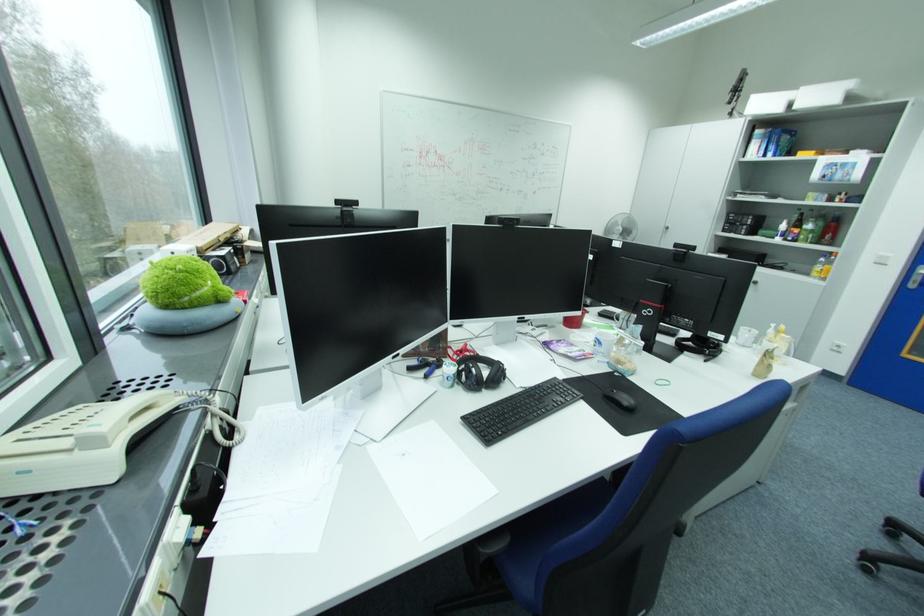
This screenshot has height=616, width=924. I want to click on silver door handle, so click(x=920, y=292).